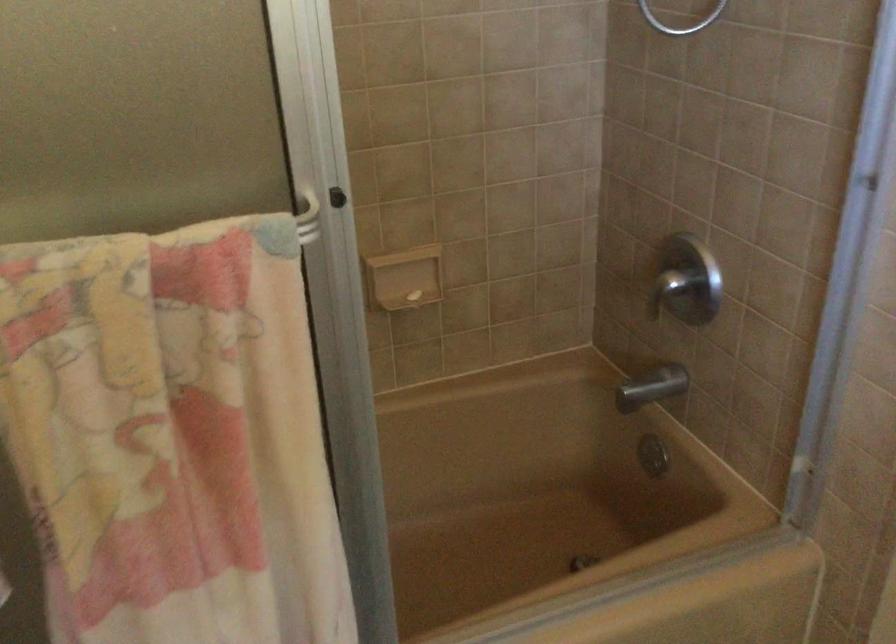
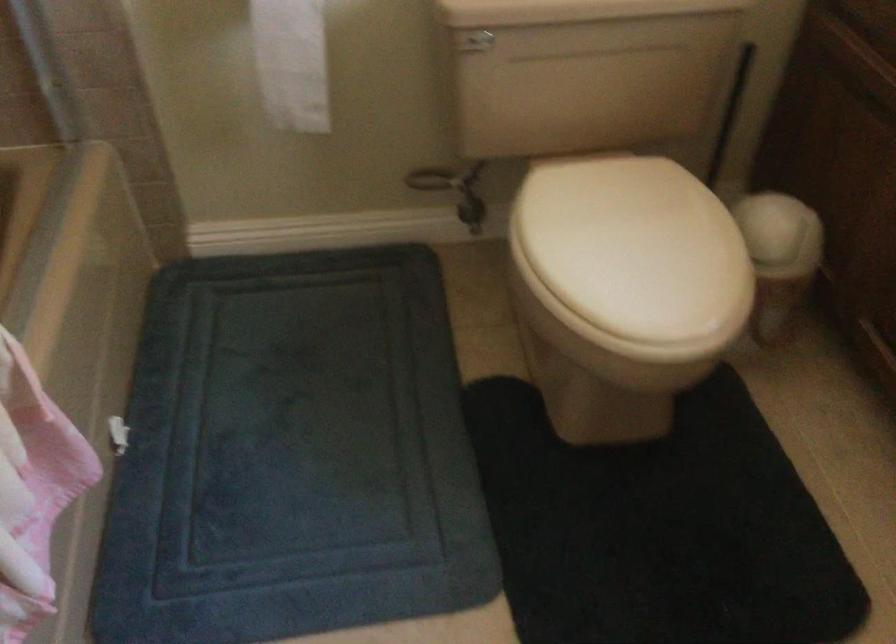
First-person continuous shooting, in which direction is the camera rotating?

The rotation direction of the camera is right-down.